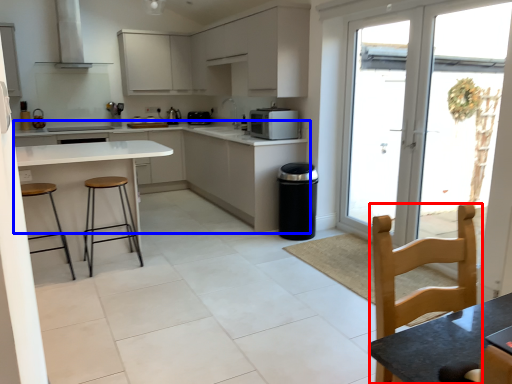
Question: Among these objects, which one is farthest to the camera, chair (highlighted by a red box) or cabinetry (highlighted by a blue box)?

Choices:
 (A) chair
 (B) cabinetry

Answer: (B)